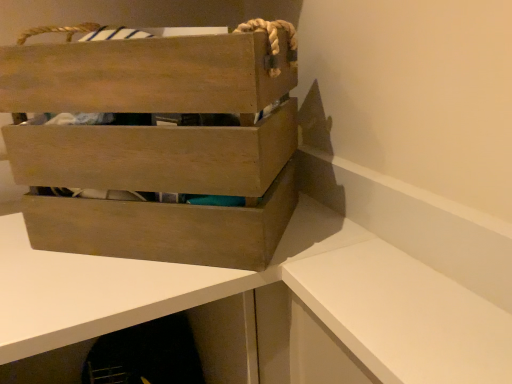
Question: Considering the positions of wooden crate at upper left and wooden crate at upper left in the image, is wooden crate at upper left wider or thinner than wooden crate at upper left?

Choices:
 (A) wide
 (B) thin

Answer: (B)

Question: Based on their sizes in the image, would you say wooden crate at upper left is bigger or smaller than wooden crate at upper left?

Choices:
 (A) small
 (B) big

Answer: (A)

Question: From a real-world perspective, relative to wooden crate at upper left, is wooden crate at upper left vertically above or below?

Choices:
 (A) below
 (B) above

Answer: (B)

Question: Relative to wooden crate at upper left, is wooden crate at upper left in front or behind?

Choices:
 (A) behind
 (B) front

Answer: (B)

Question: From a real-world perspective, is wooden crate at upper left physically located above or below wooden crate at upper left?

Choices:
 (A) above
 (B) below

Answer: (B)

Question: Choose the correct answer: Is wooden crate at upper left inside wooden crate at upper left or outside it?

Choices:
 (A) inside
 (B) outside

Answer: (B)

Question: Considering the relative positions of wooden crate at upper left and wooden crate at upper left in the image provided, is wooden crate at upper left to the left or to the right of wooden crate at upper left?

Choices:
 (A) left
 (B) right

Answer: (A)